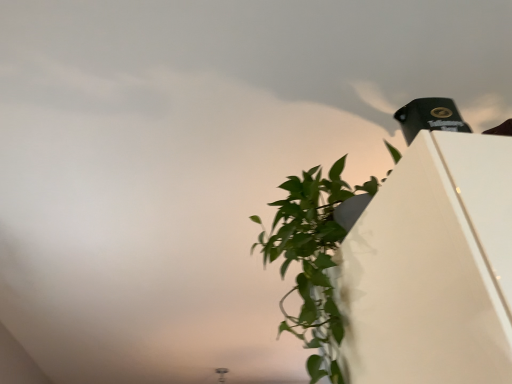
Find the location of a particular element. The height and width of the screenshot is (384, 512). green glossy plant at upper right is located at coordinates (312, 259).

Describe the element at coordinates (312, 259) in the screenshot. This screenshot has height=384, width=512. I see `green glossy plant at upper right` at that location.

At what (x,y) coordinates should I click in order to perform the action: click on green glossy plant at upper right. Please return your answer as a coordinate pair (x, y). The image size is (512, 384). Looking at the image, I should click on (312, 259).